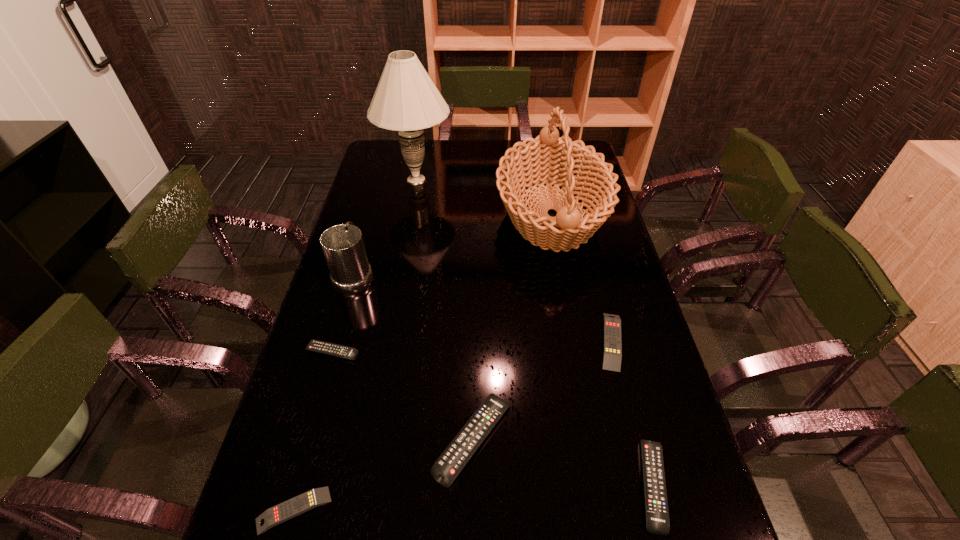
This screenshot has height=540, width=960. Find the location of `free point located on the back of the right yellow remote control`. free point located on the back of the right yellow remote control is located at coordinates (584, 237).

The height and width of the screenshot is (540, 960). In order to click on vacant area located on the back of the second black remote control from left to right in this screenshot , I will do `click(473, 358)`.

Image resolution: width=960 pixels, height=540 pixels. Identify the location of vacant space located on the left of the second smallest black remote control. (511, 485).

Locate an element on the screen. vacant point located 0.180m on the right of the nearer yellow remote control is located at coordinates (419, 510).

Identify the location of vacant region located 0.060m on the right of the smallest black remote control. (382, 352).

Image resolution: width=960 pixels, height=540 pixels. I want to click on object that is positioned at the far edge, so click(406, 100).

You are a GUI agent. You are given a task and a screenshot of the screen. Output one action in this format:
    pyautogui.click(x=<x>, y=<y>)
    Task: Click on the lampshade at the left edge
    The image size is (960, 540).
    Given the screenshot: What is the action you would take?
    pyautogui.click(x=406, y=100)

Identify the location of mug that is at the left edge. The height and width of the screenshot is (540, 960). (343, 247).

Where is `basket located at the right edge`? basket located at the right edge is located at coordinates (548, 159).

Locate an element on the screen. Image resolution: width=960 pixels, height=540 pixels. object at the far left corner is located at coordinates [x=406, y=100].